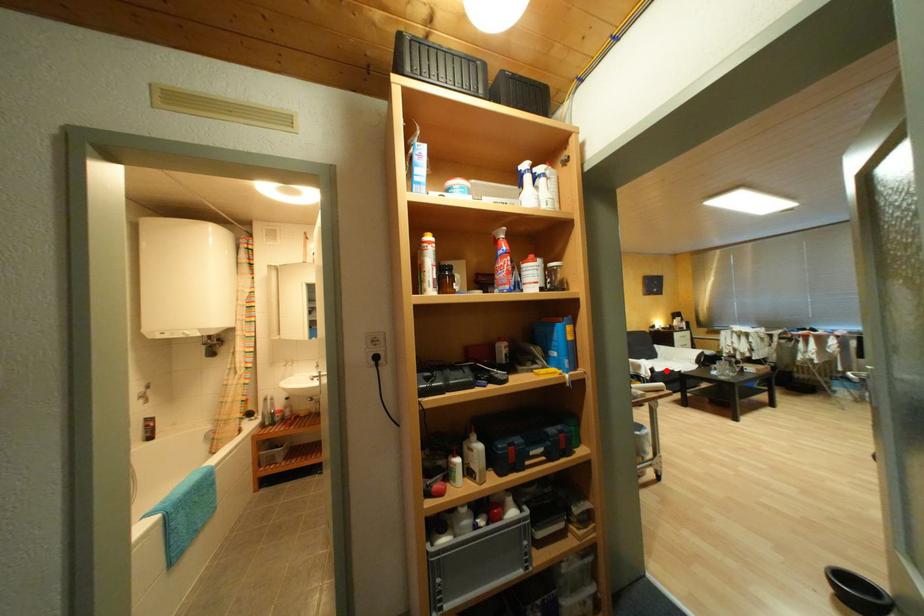
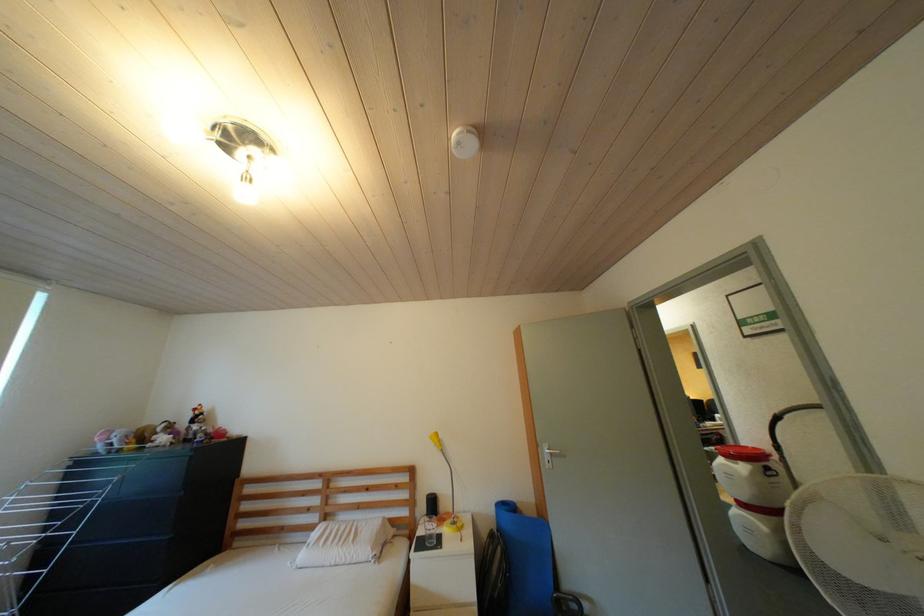
Question: I am providing you with two images of the same scene from different viewpoints. A red point is marked on the first image. At the location where the point appears in image 1, is it still visible in image 2?

Choices:
 (A) Yes
 (B) No

Answer: (B)